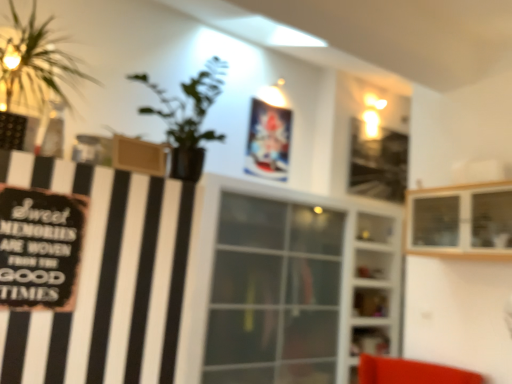
Question: Can you confirm if transparent glass shelves at center, the 1th shelf when ordered from bottom to top, is wider than transparent glass window at center?

Choices:
 (A) yes
 (B) no

Answer: (B)

Question: Is transparent glass shelves at center, marked as the second shelf in a top-to-bottom arrangement, closer to camera compared to transparent glass window at center?

Choices:
 (A) yes
 (B) no

Answer: (B)

Question: From a real-world perspective, does transparent glass shelves at center, which ranks as the 2th shelf in front-to-back order, sit lower than transparent glass window at center?

Choices:
 (A) no
 (B) yes

Answer: (A)

Question: Does transparent glass shelves at center, which ranks as the 2th shelf in front-to-back order, have a larger size compared to transparent glass window at center?

Choices:
 (A) yes
 (B) no

Answer: (B)

Question: Is transparent glass shelves at center, the 1th shelf when ordered from back to front, not close to transparent glass window at center?

Choices:
 (A) yes
 (B) no

Answer: (B)

Question: Can you confirm if transparent glass shelves at center, the 1th shelf when ordered from back to front, is positioned to the right of transparent glass window at center?

Choices:
 (A) yes
 (B) no

Answer: (A)

Question: Is black matte signboard at left at the left side of transparent glass window at center?

Choices:
 (A) yes
 (B) no

Answer: (A)

Question: Is black matte signboard at left oriented away from transparent glass window at center?

Choices:
 (A) no
 (B) yes

Answer: (A)

Question: Is black matte signboard at left closer to camera compared to transparent glass window at center?

Choices:
 (A) no
 (B) yes

Answer: (B)

Question: Does black matte signboard at left have a greater height compared to transparent glass window at center?

Choices:
 (A) no
 (B) yes

Answer: (A)

Question: From a real-world perspective, does black matte signboard at left stand above transparent glass window at center?

Choices:
 (A) yes
 (B) no

Answer: (A)

Question: Does black matte signboard at left lie behind transparent glass window at center?

Choices:
 (A) no
 (B) yes

Answer: (A)

Question: Is wooden cabinet at upper right, the second shelf ordered from the bottom, completely or partially inside green leafy plant at left?

Choices:
 (A) yes
 (B) no

Answer: (B)